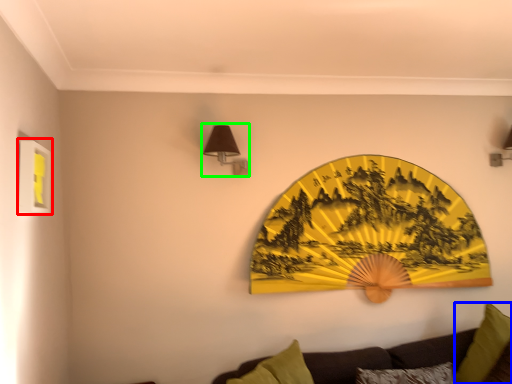
Question: Based on their relative distances, which object is farther from picture frame (highlighted by a red box)? Choose from pillow (highlighted by a blue box) and lamp (highlighted by a green box).

Choices:
 (A) pillow
 (B) lamp

Answer: (A)